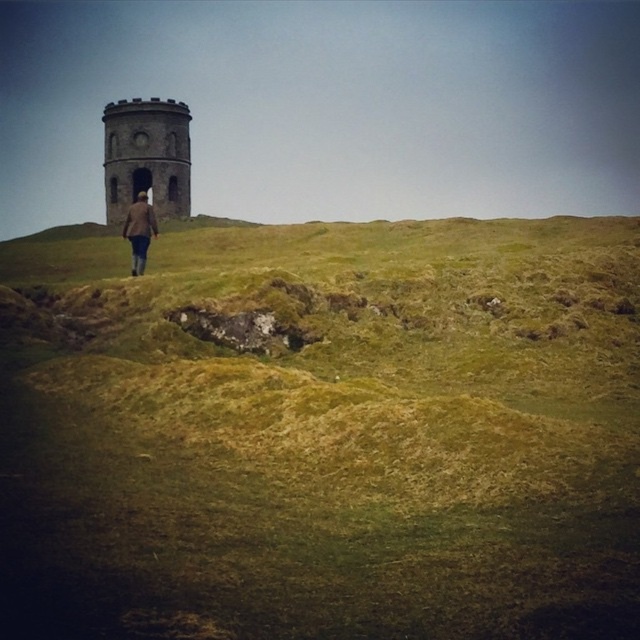
Question: Does green grassy hillside at center appear on the left side of brown stone tower at upper left?

Choices:
 (A) yes
 (B) no

Answer: (B)

Question: Is green grassy hillside at center wider than brown woolen coat at center?

Choices:
 (A) yes
 (B) no

Answer: (A)

Question: Which object is farther from the camera taking this photo?

Choices:
 (A) brown woolen coat at center
 (B) green grassy hillside at center
 (C) brown stone tower at upper left

Answer: (C)

Question: Does green grassy hillside at center appear over brown stone tower at upper left?

Choices:
 (A) no
 (B) yes

Answer: (A)

Question: Which object is the farthest from the brown woolen coat at center?

Choices:
 (A) brown stone tower at upper left
 (B) green grassy hillside at center

Answer: (B)

Question: Estimate the real-world distances between objects in this image. Which object is farther from the brown woolen coat at center?

Choices:
 (A) brown stone tower at upper left
 (B) green grassy hillside at center

Answer: (B)